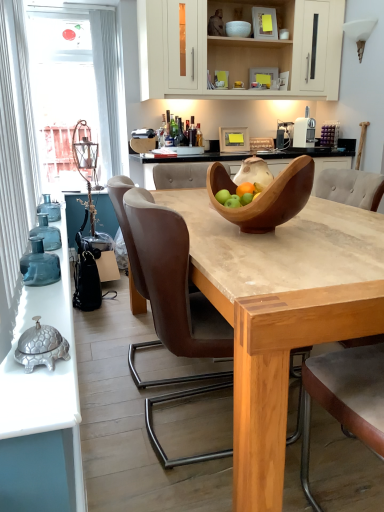
Measure the distance between light brown leather armchair at center and camera.

light brown leather armchair at center and camera are 6.12 feet apart from each other.

This screenshot has width=384, height=512. Identify the location of transparent glass window at upper left. (77, 87).

Measure the distance between brown leather chair at center and camera.

The distance of brown leather chair at center from camera is 3.75 feet.

What do you see at coordinates (238, 29) in the screenshot? I see `white glossy bowl at upper center, acting as the 1th bowl starting from the top` at bounding box center [238, 29].

Identify the location of light brown leather armchair at center. The image size is (384, 512). (351, 187).

Considering the positions of objects transparent glass window at upper left and white matte cabinet at upper center in the image provided, who is more to the right, transparent glass window at upper left or white matte cabinet at upper center?

white matte cabinet at upper center is more to the right.

Could you tell me if transparent glass window at upper left is facing white matte cabinet at upper center?

No, transparent glass window at upper left is not facing towards white matte cabinet at upper center.

From a real-world perspective, is transparent glass window at upper left on top of white matte cabinet at upper center?

No, from a real-world perspective, transparent glass window at upper left is not over white matte cabinet at upper center

Between transparent glass window at upper left and white matte cabinet at upper center, which one has smaller width?

transparent glass window at upper left is thinner.

From a real-world perspective, who is located lower, brown leather chair at center or transparent glass window at upper left?

brown leather chair at center.

Who is bigger, brown leather chair at center or transparent glass window at upper left?

brown leather chair at center is bigger.

Does point (215, 376) come closer to viewer compared to point (49, 77)?

Yes, it is.

Is brown leather chair at center in contact with transparent glass window at upper left?

brown leather chair at center and transparent glass window at upper left are clearly separated.

Is brown leather chair at center not inside translucent glass bottles at left?

Absolutely, brown leather chair at center is external to translucent glass bottles at left.

Consider the image. Does brown leather chair at center turn towards translucent glass bottles at left?

No, brown leather chair at center is not facing towards translucent glass bottles at left.

From a real-world perspective, is brown leather chair at center physically located above or below translucent glass bottles at left?

brown leather chair at center is below translucent glass bottles at left.

Does brown leather chair at center touch translucent glass bottles at left?

No, brown leather chair at center is not next to translucent glass bottles at left.

Which object is wider, wooden bowl at center, which is the 1th bowl in front-to-back order, or brown leather chair at center?

brown leather chair at center is wider.

Considering the points (234, 184) and (137, 237), which point is in front, point (234, 184) or point (137, 237)?

The point (137, 237) is in front.

How distant is wooden bowl at center, which is the 1th bowl in front-to-back order, from brown leather chair at center?

wooden bowl at center, which is the 1th bowl in front-to-back order, and brown leather chair at center are 12.46 inches apart from each other.

Choose the correct answer: Is wooden bowl at center, the 1th bowl positioned from the bottom, inside brown leather chair at center or outside it?

wooden bowl at center, the 1th bowl positioned from the bottom, exists entirely within brown leather chair at center.

Considering the relative sizes of brown leather chair at center and wooden bowl at center, which is the 1th bowl in front-to-back order, in the image provided, is brown leather chair at center shorter than wooden bowl at center, which is the 1th bowl in front-to-back order,?

Incorrect, the height of brown leather chair at center does not fall short of that of wooden bowl at center, which is the 1th bowl in front-to-back order.

What's the angular difference between brown leather chair at center and wooden bowl at center, the 1th bowl positioned from the bottom,'s facing directions?

The angle between the facing direction of brown leather chair at center and the facing direction of wooden bowl at center, the 1th bowl positioned from the bottom, is 0.572 degrees.

The height and width of the screenshot is (512, 384). Identify the location of chair in front of the wooden bowl at center, which is the 2th bowl from top to bottom. (172, 297).

Looking at this image, is transparent glass window at upper left facing away from light brown leather armchair at center?

No, transparent glass window at upper left is not facing the opposite direction of light brown leather armchair at center.

From the image's perspective, is transparent glass window at upper left located above or below light brown leather armchair at center?

transparent glass window at upper left is above light brown leather armchair at center.

Are transparent glass window at upper left and light brown leather armchair at center making contact?

No, transparent glass window at upper left is not touching light brown leather armchair at center.

Which is behind, transparent glass window at upper left or light brown leather armchair at center?

transparent glass window at upper left is more distant.

Which is more to the left, white glossy bowl at upper center, acting as the 1th bowl starting from the top, or translucent glass bottles at left?

Positioned to the left is translucent glass bottles at left.

Does point (231, 25) come in front of point (39, 510)?

No, (231, 25) is further to viewer.

From the image's perspective, which is below, white glossy bowl at upper center, which appears as the first bowl when viewed from the back, or translucent glass bottles at left?

translucent glass bottles at left.

From a real-world perspective, relative to translucent glass bottles at left, is white glossy bowl at upper center, which appears as the first bowl when viewed from the back, vertically above or below?

Clearly, from a real-world perspective, white glossy bowl at upper center, which appears as the first bowl when viewed from the back, is above translucent glass bottles at left.

Where is `cabinetry lying on the right of transparent glass window at upper left`? cabinetry lying on the right of transparent glass window at upper left is located at coordinates (237, 48).

The image size is (384, 512). What are the coordinates of `window screen located above the brown leather chair at center (from a real-world perspective)` in the screenshot? It's located at (77, 87).

When comparing their distances from brown leather chair at center, does light brown leather armchair at center or wooden bowl at center, which is the 2th bowl from back to front, seem closer?

wooden bowl at center, which is the 2th bowl from back to front, lies closer to brown leather chair at center than the other object.

Estimate the real-world distances between objects in this image. Which object is further from white matte cabinet at upper center, translucent glass bottles at left or brown leather chair at center?

translucent glass bottles at left lies further to white matte cabinet at upper center than the other object.

Estimate the real-world distances between objects in this image. Which object is closer to translucent glass bottles at left, white matte cabinet at upper center or wooden bowl at center, the 1th bowl positioned from the bottom?

The object closer to translucent glass bottles at left is wooden bowl at center, the 1th bowl positioned from the bottom.

When comparing their distances from white glossy bowl at upper center, acting as the 1th bowl starting from the top, does transparent glass window at upper left or brown leather chair at center seem further?

Among the two, brown leather chair at center is located further to white glossy bowl at upper center, acting as the 1th bowl starting from the top.

Based on their spatial positions, is white matte cabinet at upper center or light brown leather armchair at center closer to wooden bowl at center, which is the 2th bowl from top to bottom?

light brown leather armchair at center lies closer to wooden bowl at center, which is the 2th bowl from top to bottom, than the other object.

From the image, which object appears to be nearer to light brown leather armchair at center, white matte cabinet at upper center or brown leather chair at center?

Based on the image, brown leather chair at center appears to be nearer to light brown leather armchair at center.

From the image, which object appears to be farther from wooden bowl at center, which is the 2th bowl from back to front, white glossy bowl at upper center, acting as the 1th bowl starting from the top, or brown leather chair at center?

white glossy bowl at upper center, acting as the 1th bowl starting from the top, lies further to wooden bowl at center, which is the 2th bowl from back to front, than the other object.

Considering their positions, is transparent glass window at upper left positioned closer to translucent glass bottles at left than white matte cabinet at upper center?

Among the two, transparent glass window at upper left is located nearer to translucent glass bottles at left.

Where is `cabinetry between wooden bowl at center, which is the 2th bowl from back to front, and white glossy bowl at upper center, which is the 2th bowl in bottom-to-top order, in the front-back direction`? cabinetry between wooden bowl at center, which is the 2th bowl from back to front, and white glossy bowl at upper center, which is the 2th bowl in bottom-to-top order, in the front-back direction is located at coordinates (237, 48).

Locate an element on the screen. This screenshot has width=384, height=512. chair between translucent glass bottles at left and light brown leather armchair at center in the horizontal direction is located at coordinates (172, 297).

Where is `cabinetry between wooden bowl at center, which is the 2th bowl from top to bottom, and transparent glass window at upper left, along the z-axis`? Image resolution: width=384 pixels, height=512 pixels. cabinetry between wooden bowl at center, which is the 2th bowl from top to bottom, and transparent glass window at upper left, along the z-axis is located at coordinates (237, 48).

Image resolution: width=384 pixels, height=512 pixels. I want to click on cabinetry located between brown leather chair at center and white glossy bowl at upper center, which appears as the first bowl when viewed from the back, in the depth direction, so click(237, 48).